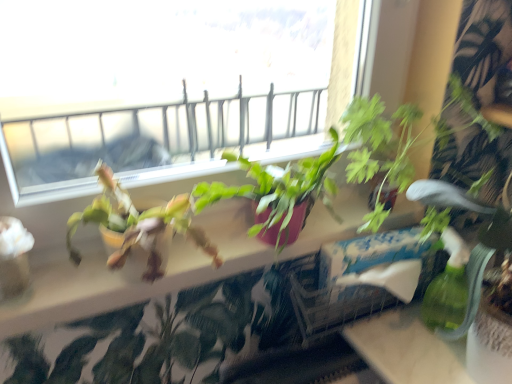
Describe the element at coordinates (362, 280) in the screenshot. I see `white cardboard box at center` at that location.

The image size is (512, 384). Identify the location of green leafy plant at right. (478, 240).

Is matte pink pot at center turned away from green leafy plant at right?

No, matte pink pot at center's orientation is not away from green leafy plant at right.

The image size is (512, 384). I want to click on houseplant in front of the matte pink pot at center, so click(x=478, y=240).

From the image's perspective, between matte pink pot at center and green leafy plant at right, who is located below?

matte pink pot at center, from the image's perspective.

Would you say white cardboard box at center is a long distance from green leafy plant at right?

No, white cardboard box at center is not far from green leafy plant at right.

Find the location of a particular element. The width and height of the screenshot is (512, 384). window box located underneath the green leafy plant at right (from a real-world perspective) is located at coordinates (362, 280).

Which of these two, white cardboard box at center or green leafy plant at right, is wider?

green leafy plant at right.

How far apart are matte pink pot at center and white cardboard box at center?

13.74 centimeters.

Locate an element on the screen. The height and width of the screenshot is (384, 512). window sill that appears in front of the white cardboard box at center is located at coordinates (130, 283).

Is matte pink pot at center taller or shorter than white cardboard box at center?

Clearly, matte pink pot at center is shorter compared to white cardboard box at center.

Which object is positioned more to the left, matte pink pot at center or white cardboard box at center?

matte pink pot at center is more to the left.

How different are the orientations of green leafy plant at right and matte pink pot at center in degrees?

green leafy plant at right and matte pink pot at center are facing 2.06 degrees away from each other.

Which object is further away from the camera, green leafy plant at right or matte pink pot at center?

matte pink pot at center is further from the camera.

Considering the relative positions of green leafy plant at right and matte pink pot at center in the image provided, is green leafy plant at right to the left of matte pink pot at center from the viewer's perspective?

No, green leafy plant at right is not to the left of matte pink pot at center.

Is green leafy plant at right facing away from matte pink pot at center?

green leafy plant at right does not have its back to matte pink pot at center.

In terms of size, does green leafy plant at right appear bigger or smaller than white cardboard box at center?

Clearly, green leafy plant at right is larger in size than white cardboard box at center.

Considering their positions, is green leafy plant at right located in front of or behind white cardboard box at center?

Visually, green leafy plant at right is located in front of white cardboard box at center.

How different are the orientations of green leafy plant at right and white cardboard box at center in degrees?

They differ by 1.75 degrees in their facing directions.

Looking at their sizes, would you say green leafy plant at right is wider or thinner than white cardboard box at center?

green leafy plant at right is wider than white cardboard box at center.

Is white cardboard box at center looking in the opposite direction of matte pink pot at center?

No, matte pink pot at center is not at the back of white cardboard box at center.

Considering the relative positions of white cardboard box at center and matte pink pot at center in the image provided, is white cardboard box at center to the left or to the right of matte pink pot at center?

white cardboard box at center is positioned on matte pink pot at center's right side.

Is white cardboard box at center not close to matte pink pot at center?

No, white cardboard box at center is not far from matte pink pot at center.

From the image's perspective, between white cardboard box at center and matte pink pot at center, who is located below?

white cardboard box at center.

The image size is (512, 384). Find the location of `houseplant that appears in front of the matte pink pot at center`. houseplant that appears in front of the matte pink pot at center is located at coordinates (478, 240).

Locate an element on the screen. houseplant on the right side of white cardboard box at center is located at coordinates (478, 240).

Looking at the image, which one is located further to matte pink pot at center, white cardboard box at center or green leafy plant at right?

Based on the image, green leafy plant at right appears to be further to matte pink pot at center.

Estimate the real-world distances between objects in this image. Which object is further from green leafy plant at right, white cardboard box at center or matte pink pot at center?

matte pink pot at center.

Based on their spatial positions, is green leafy plant at right or matte pink pot at center closer to white cardboard box at center?

matte pink pot at center is closer to white cardboard box at center.

Estimate the real-world distances between objects in this image. Which object is closer to green leafy plant at right, matte pink pot at center or white cardboard box at center?

Based on the image, white cardboard box at center appears to be nearer to green leafy plant at right.

From the picture: When comparing their distances from matte pink pot at center, does green leafy plant at right or white cardboard box at center seem further?

green leafy plant at right.

Looking at the image, which one is located closer to white cardboard box at center, matte pink pot at center or green leafy plant at right?

Among the two, matte pink pot at center is located nearer to white cardboard box at center.

This screenshot has width=512, height=384. In order to click on window box between matte pink pot at center and green leafy plant at right from left to right in this screenshot , I will do `click(362, 280)`.